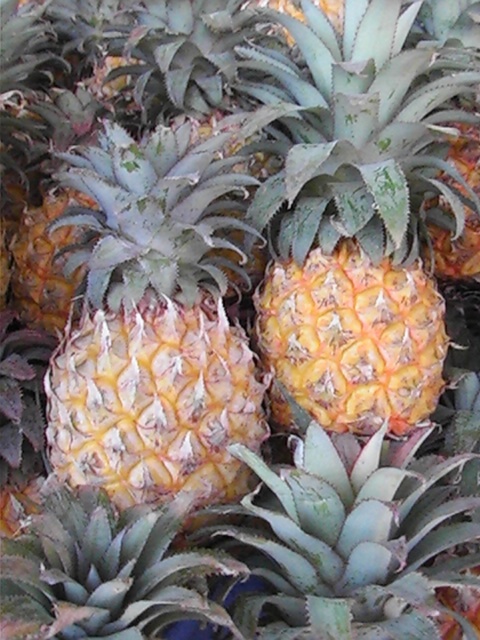
Question: Can you confirm if yellow matte pineapple at center is positioned above yellow textured pineapple at center?

Choices:
 (A) no
 (B) yes

Answer: (B)

Question: Among these points, which one is nearest to the camera?

Choices:
 (A) (x=106, y=259)
 (B) (x=424, y=234)

Answer: (A)

Question: Which point is farther to the camera?

Choices:
 (A) yellow textured pineapple at center
 (B) yellow matte pineapple at center

Answer: (B)

Question: Observing the image, what is the correct spatial positioning of yellow matte pineapple at center in reference to yellow textured pineapple at center?

Choices:
 (A) right
 (B) left

Answer: (A)

Question: Observing the image, what is the correct spatial positioning of yellow matte pineapple at center in reference to yellow textured pineapple at center?

Choices:
 (A) left
 (B) right

Answer: (B)